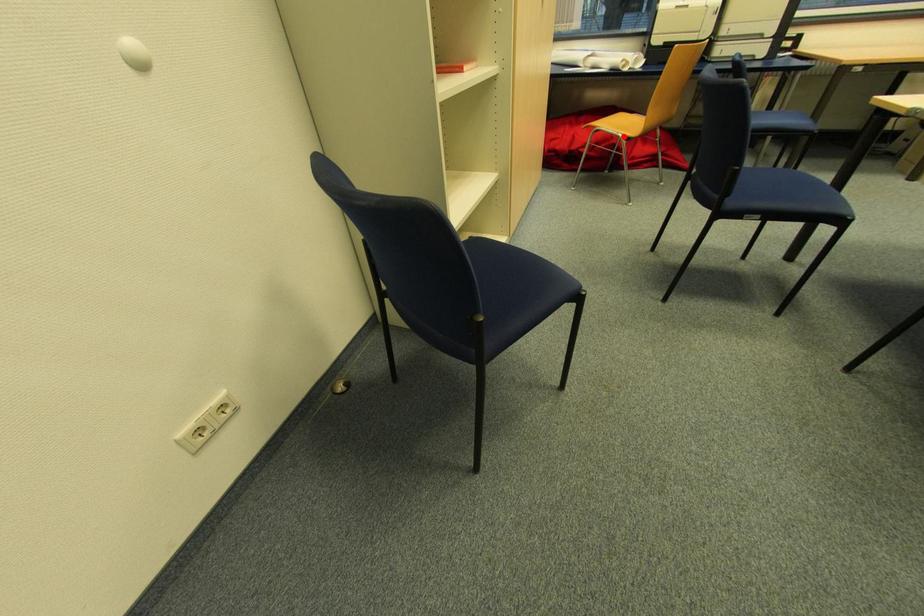
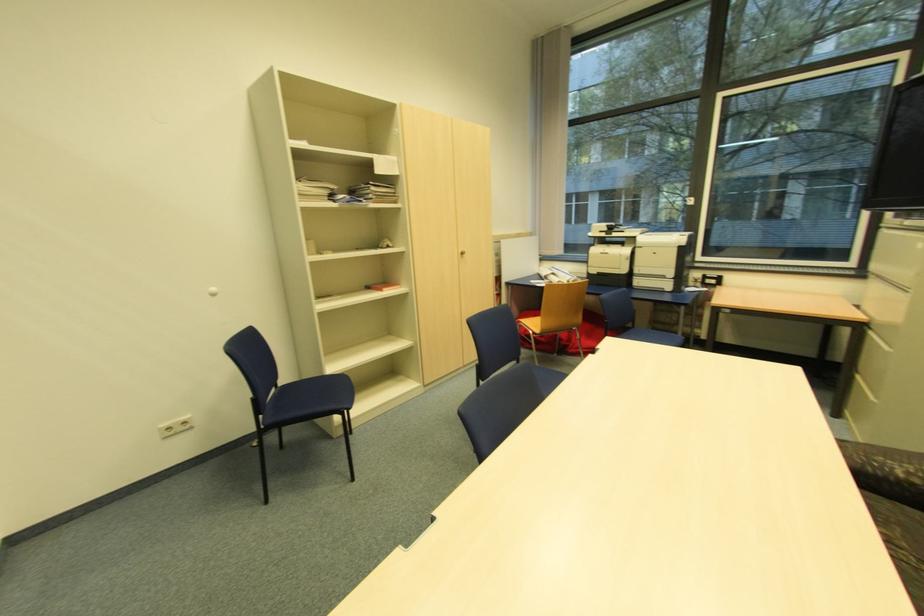
Question: I am providing you with two images of the same scene from different viewpoints. A red point is marked on the first image. Is the red point's position out of view in image 2?

Choices:
 (A) Yes
 (B) No

Answer: (B)